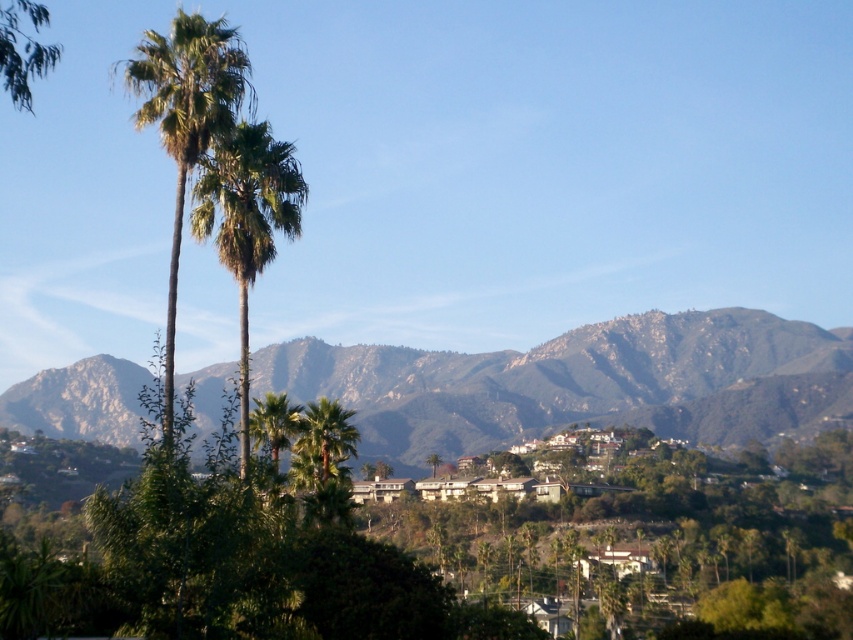
You are a hiker standing in front of the green leafy palm at left and the green leafy palm tree at center. Which palm tree is closer to your left side?

The green leafy palm at left is closer to your left side because it is positioned on the left side of the green leafy palm tree at center.